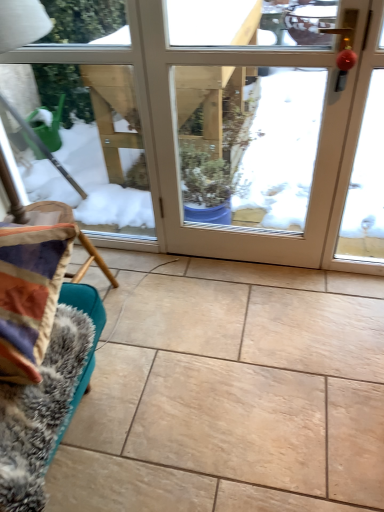
This screenshot has width=384, height=512. In order to click on fuzzy fabric couch at lower left in this screenshot , I will do `click(47, 400)`.

Considering the sizes of objects fuzzy fabric couch at lower left and beige ceramic tile at center in the image provided, who is thinner, fuzzy fabric couch at lower left or beige ceramic tile at center?

fuzzy fabric couch at lower left.

Considering their positions, is fuzzy fabric couch at lower left located in front of or behind beige ceramic tile at center?

fuzzy fabric couch at lower left is in front of beige ceramic tile at center.

In the scene shown: Choose the correct answer: Is fuzzy fabric couch at lower left inside beige ceramic tile at center or outside it?

fuzzy fabric couch at lower left is outside beige ceramic tile at center.

Find the location of `furniture that appears in front of the beige ceramic tile at center`. furniture that appears in front of the beige ceramic tile at center is located at coordinates (47, 400).

Does white glossy door at center turn towards fuzzy fabric couch at lower left?

Yes, white glossy door at center faces towards fuzzy fabric couch at lower left.

Identify the location of door behind the fuzzy fabric couch at lower left. (211, 124).

Considering the sizes of objects white glossy door at center and fuzzy fabric couch at lower left in the image provided, who is shorter, white glossy door at center or fuzzy fabric couch at lower left?

fuzzy fabric couch at lower left.

Is white glossy door at center with fuzzy fabric couch at lower left?

No, white glossy door at center is not with fuzzy fabric couch at lower left.

From a real-world perspective, does white glossy door at center sit lower than beige ceramic tile at center?

No.

The image size is (384, 512). There is a beige ceramic tile at center. In order to click on door above it (from a real-world perspective) in this screenshot , I will do `click(211, 124)`.

Relative to beige ceramic tile at center, is white glossy door at center in front or behind?

Visually, white glossy door at center is located behind beige ceramic tile at center.

From the image's perspective, which object appears higher, white glossy door at center or beige ceramic tile at center?

From the image's view, white glossy door at center is above.

Is beige ceramic tile at center completely or partially outside of fuzzy fabric couch at lower left?

Indeed, beige ceramic tile at center is completely outside fuzzy fabric couch at lower left.

Are beige ceramic tile at center and fuzzy fabric couch at lower left located far from each other?

beige ceramic tile at center is actually quite close to fuzzy fabric couch at lower left.

From a real-world perspective, is beige ceramic tile at center over fuzzy fabric couch at lower left?

Incorrect, from a real-world perspective, beige ceramic tile at center is lower than fuzzy fabric couch at lower left.

Considering the sizes of objects beige ceramic tile at center and fuzzy fabric couch at lower left in the image provided, who is taller, beige ceramic tile at center or fuzzy fabric couch at lower left?

Standing taller between the two is fuzzy fabric couch at lower left.

Which object is wider, beige ceramic tile at center or white glossy door at center?

beige ceramic tile at center.

Which of these two, beige ceramic tile at center or white glossy door at center, is smaller?

white glossy door at center is smaller.

Would you say beige ceramic tile at center is to the left or to the right of white glossy door at center in the picture?

Based on their positions, beige ceramic tile at center is located to the left of white glossy door at center.

Is fuzzy fabric couch at lower left turned away from white glossy door at center?

fuzzy fabric couch at lower left does not have its back to white glossy door at center.

Is white glossy door at center inside fuzzy fabric couch at lower left?

No, white glossy door at center is not surrounded by fuzzy fabric couch at lower left.

Is fuzzy fabric couch at lower left at the right side of white glossy door at center?

No, fuzzy fabric couch at lower left is not to the right of white glossy door at center.

Where is `ceramic tile that appears behind the fuzzy fabric couch at lower left`? The height and width of the screenshot is (512, 384). ceramic tile that appears behind the fuzzy fabric couch at lower left is located at coordinates (229, 391).

This screenshot has height=512, width=384. What are the coordinates of `door above the fuzzy fabric couch at lower left (from the image's perspective)` in the screenshot? It's located at (211, 124).

When comparing their distances from beige ceramic tile at center, does fuzzy fabric couch at lower left or white glossy door at center seem further?

The object further to beige ceramic tile at center is white glossy door at center.

From the image, which object appears to be farther from white glossy door at center, fuzzy fabric couch at lower left or beige ceramic tile at center?

fuzzy fabric couch at lower left.

Looking at the image, which one is located closer to beige ceramic tile at center, white glossy door at center or fuzzy fabric couch at lower left?

The object closer to beige ceramic tile at center is fuzzy fabric couch at lower left.

Estimate the real-world distances between objects in this image. Which object is further from white glossy door at center, beige ceramic tile at center or fuzzy fabric couch at lower left?

Among the two, fuzzy fabric couch at lower left is located further to white glossy door at center.

When comparing their distances from fuzzy fabric couch at lower left, does white glossy door at center or beige ceramic tile at center seem further?

white glossy door at center lies further to fuzzy fabric couch at lower left than the other object.

Based on the photo, considering their positions, is beige ceramic tile at center positioned further to fuzzy fabric couch at lower left than white glossy door at center?

Among the two, white glossy door at center is located further to fuzzy fabric couch at lower left.

You are a GUI agent. You are given a task and a screenshot of the screen. Output one action in this format:
    pyautogui.click(x=<x>, y=<y>)
    Task: Click on the furniture between white glossy door at center and beige ceramic tile at center in the up-down direction
    The image size is (384, 512).
    Given the screenshot: What is the action you would take?
    pyautogui.click(x=47, y=400)